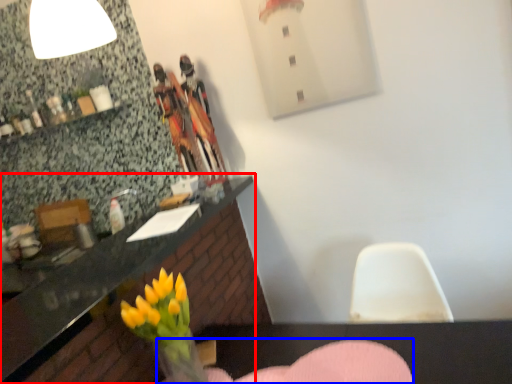
Question: Among these objects, which one is nearest to the camera, countertop (highlighted by a red box) or armchair (highlighted by a blue box)?

Choices:
 (A) countertop
 (B) armchair

Answer: (A)